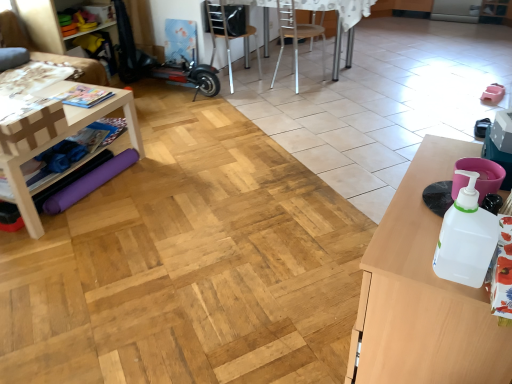
Where is `vacant space positioned to the left of wooden table at right, marked as the first table in a front-to-back arrangement`? This screenshot has width=512, height=384. vacant space positioned to the left of wooden table at right, marked as the first table in a front-to-back arrangement is located at coordinates (278, 327).